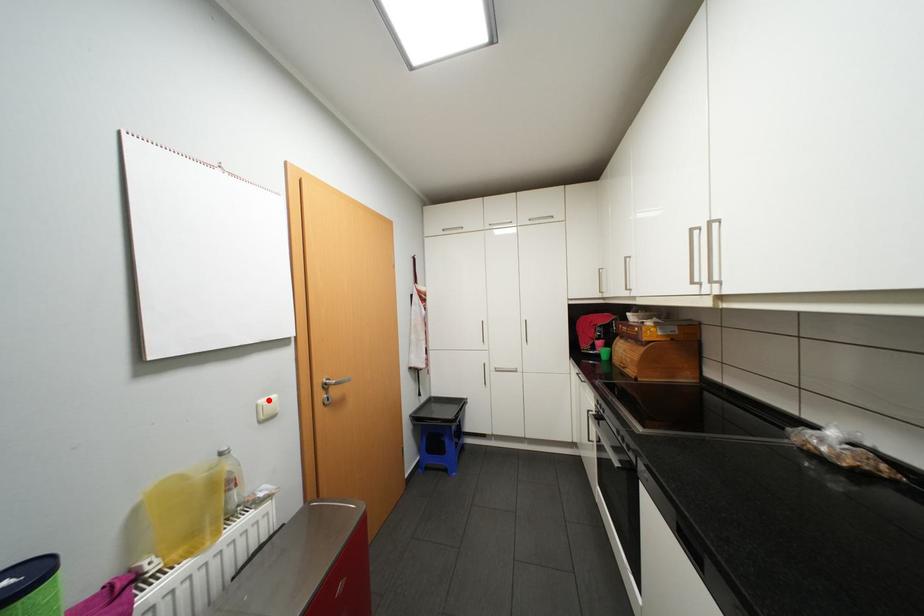
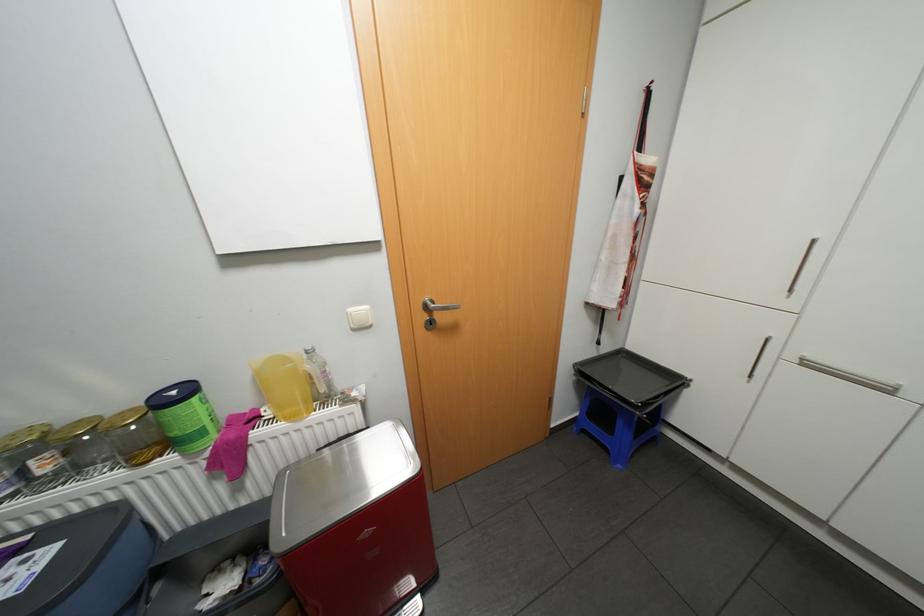
In the second image, find the point that corresponds to the highlighted location in the first image.

(358, 309)